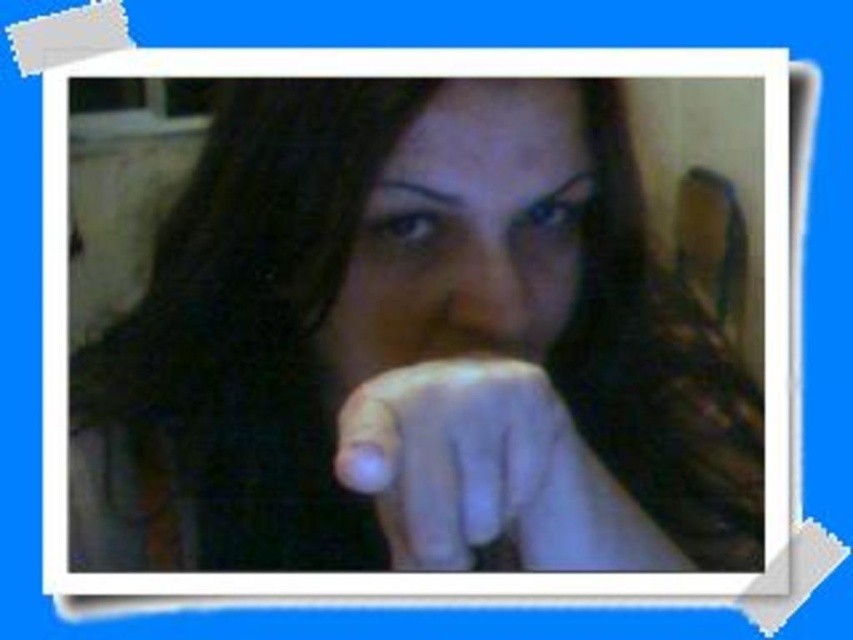
Who is more distant from viewer, (99, 401) or (451, 90)?

Point (99, 401)

Who is positioned more to the right, matte black hand at center or smooth skin face at center?

Positioned to the right is matte black hand at center.

Locate an element on the screen. The width and height of the screenshot is (853, 640). matte black hand at center is located at coordinates (415, 349).

Can you confirm if matte black hand at center is taller than white matte hand at center?

Correct, matte black hand at center is much taller as white matte hand at center.

Consider the image. Which of these two, matte black hand at center or white matte hand at center, stands shorter?

white matte hand at center

Does point (531, 552) come closer to viewer compared to point (612, 532)?

Yes, it is.

Locate an element on the screen. The height and width of the screenshot is (640, 853). matte black hand at center is located at coordinates (415, 349).

Is the position of smooth skin face at center more distant than that of white matte hand at center?

Yes.

Which is above, smooth skin face at center or white matte hand at center?

Positioned higher is smooth skin face at center.

This screenshot has height=640, width=853. I want to click on smooth skin face at center, so click(465, 234).